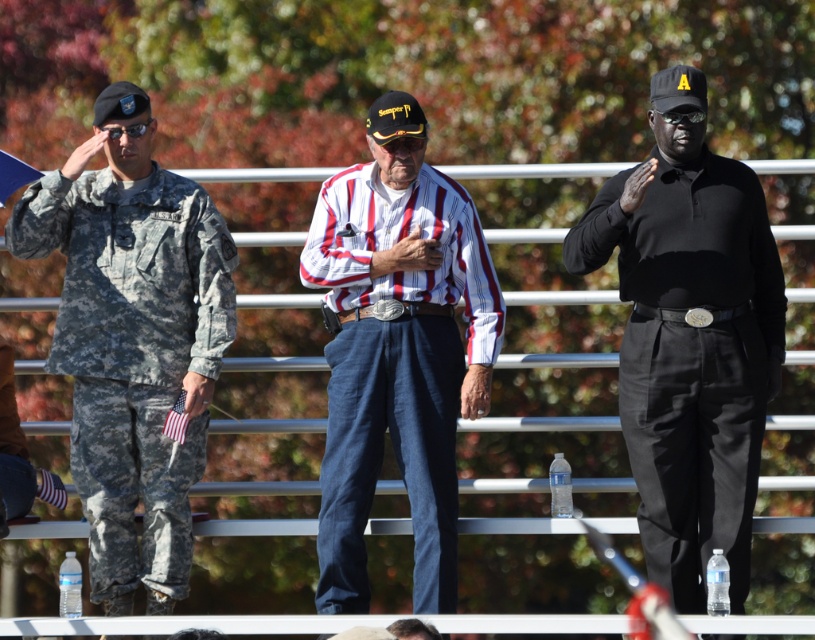
Describe the element at coordinates (397, 349) in the screenshot. I see `striped cotton shirt at center` at that location.

Is point (388, 378) in front of point (223, 227)?

Yes, it is in front of point (223, 227).

Where is `striped cotton shirt at center`? The width and height of the screenshot is (815, 640). striped cotton shirt at center is located at coordinates (397, 349).

Between black leather cap at center and camouflage fabric uniform at left, which one is positioned higher?

black leather cap at center is higher up.

Between black leather cap at center and camouflage fabric uniform at left, which one has less height?

camouflage fabric uniform at left is shorter.

This screenshot has height=640, width=815. I want to click on black leather cap at center, so click(690, 337).

Can you confirm if black leather cap at center is positioned to the left of striped cotton shirt at center?

Incorrect, black leather cap at center is not on the left side of striped cotton shirt at center.

Based on the photo, who is higher up, black leather cap at center or striped cotton shirt at center?

Positioned higher is black leather cap at center.

The width and height of the screenshot is (815, 640). Identify the location of black leather cap at center. (690, 337).

Where is `black leather cap at center`? black leather cap at center is located at coordinates (690, 337).